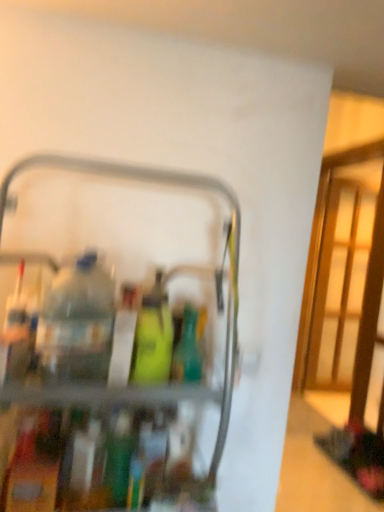
Question: Is green matte bottle at center, placed as the 2th bottle when sorted from top to bottom, thinner than green matte bottle at center, which ranks as the 3th bottle in top-to-bottom order?

Choices:
 (A) yes
 (B) no

Answer: (B)

Question: Can you confirm if green matte bottle at center, positioned as the 2th bottle in bottom-to-top order, is positioned to the left of green matte bottle at center, arranged as the 1th bottle when ordered from the bottom?

Choices:
 (A) yes
 (B) no

Answer: (B)

Question: Considering the relative sizes of green matte bottle at center, positioned as the 2th bottle in bottom-to-top order, and green matte bottle at center, arranged as the 1th bottle when ordered from the bottom, in the image provided, is green matte bottle at center, positioned as the 2th bottle in bottom-to-top order, shorter than green matte bottle at center, arranged as the 1th bottle when ordered from the bottom,?

Choices:
 (A) no
 (B) yes

Answer: (B)

Question: Is green matte bottle at center, positioned as the 2th bottle in bottom-to-top order, not close to green matte bottle at center, arranged as the 1th bottle when ordered from the bottom?

Choices:
 (A) yes
 (B) no

Answer: (B)

Question: Is green matte bottle at center, positioned as the 2th bottle in bottom-to-top order, taller than green matte bottle at center, which ranks as the 3th bottle in top-to-bottom order?

Choices:
 (A) no
 (B) yes

Answer: (A)

Question: Considering the positions of green matte bottle at center, arranged as the third bottle when ordered from the bottom, and metallic gray cart at center in the image, is green matte bottle at center, arranged as the third bottle when ordered from the bottom, wider or thinner than metallic gray cart at center?

Choices:
 (A) wide
 (B) thin

Answer: (B)

Question: From the image's perspective, relative to metallic gray cart at center, is green matte bottle at center, which is the 1th bottle in top-to-bottom order, above or below?

Choices:
 (A) below
 (B) above

Answer: (B)

Question: Considering the positions of point (140, 318) and point (23, 161), is point (140, 318) closer or farther from the camera than point (23, 161)?

Choices:
 (A) farther
 (B) closer

Answer: (B)

Question: From a real-world perspective, is green matte bottle at center, arranged as the third bottle when ordered from the bottom, above or below metallic gray cart at center?

Choices:
 (A) below
 (B) above

Answer: (B)

Question: Does point (198, 380) appear closer or farther from the camera than point (28, 167)?

Choices:
 (A) closer
 (B) farther

Answer: (A)

Question: From the image's perspective, is green matte bottle at center, placed as the 2th bottle when sorted from top to bottom, located above or below metallic gray cart at center?

Choices:
 (A) above
 (B) below

Answer: (A)

Question: Considering the positions of green matte bottle at center, positioned as the 2th bottle in bottom-to-top order, and metallic gray cart at center in the image, is green matte bottle at center, positioned as the 2th bottle in bottom-to-top order, wider or thinner than metallic gray cart at center?

Choices:
 (A) wide
 (B) thin

Answer: (B)

Question: Based on their sizes in the image, would you say green matte bottle at center, positioned as the 2th bottle in bottom-to-top order, is bigger or smaller than metallic gray cart at center?

Choices:
 (A) big
 (B) small

Answer: (B)

Question: From the image's perspective, is green matte bottle at center, arranged as the 1th bottle when ordered from the bottom, located above or below green matte bottle at center, placed as the 2th bottle when sorted from top to bottom?

Choices:
 (A) below
 (B) above

Answer: (A)

Question: Is green matte bottle at center, arranged as the 1th bottle when ordered from the bottom, inside the boundaries of green matte bottle at center, placed as the 2th bottle when sorted from top to bottom, or outside?

Choices:
 (A) inside
 (B) outside

Answer: (B)